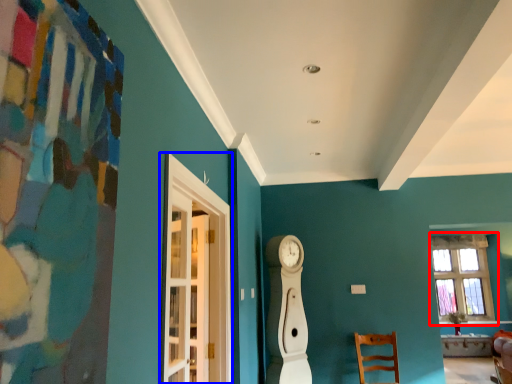
Question: Among these objects, which one is farthest to the camera, window (highlighted by a red box) or glass door (highlighted by a blue box)?

Choices:
 (A) window
 (B) glass door

Answer: (A)